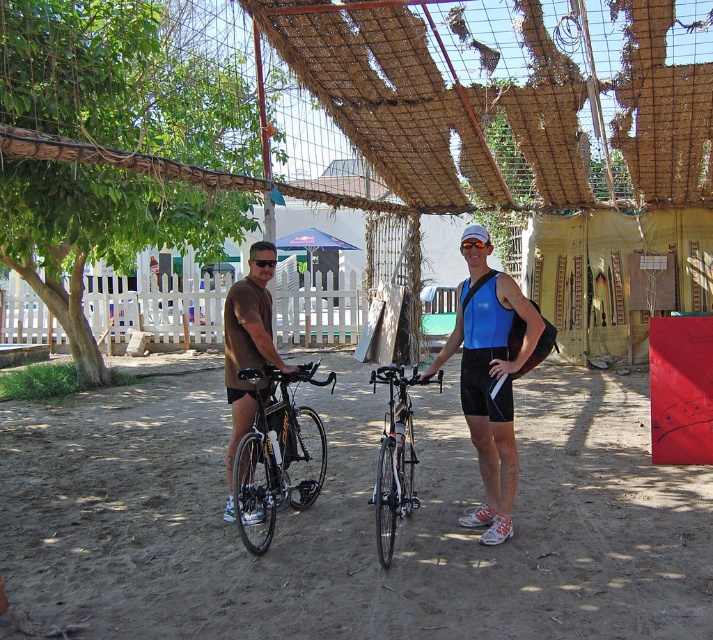
Identify the location of brown sandy dirt track at center. (352, 518).

Who is more distant from viewer, [220,540] or [548,326]?

Point [220,540]

Identify the location of brown sandy dirt track at center. This screenshot has height=640, width=713. (352, 518).

Does blue matte tank top at center appear on the left side of black matte bicycle at center?

Incorrect, blue matte tank top at center is not on the left side of black matte bicycle at center.

Does blue matte tank top at center appear over black matte bicycle at center?

Indeed, blue matte tank top at center is positioned over black matte bicycle at center.

Which is behind, point (515, 488) or point (304, 477)?

The point (304, 477) is behind.

This screenshot has height=640, width=713. I want to click on blue matte tank top at center, so click(488, 376).

Can you confirm if brown sandy dirt track at center is wider than black matte bicycle at center?

Yes, brown sandy dirt track at center is wider than black matte bicycle at center.

Does brown sandy dirt track at center appear over black matte bicycle at center?

Actually, brown sandy dirt track at center is below black matte bicycle at center.

The height and width of the screenshot is (640, 713). Describe the element at coordinates (352, 518) in the screenshot. I see `brown sandy dirt track at center` at that location.

The width and height of the screenshot is (713, 640). Identify the location of brown sandy dirt track at center. (352, 518).